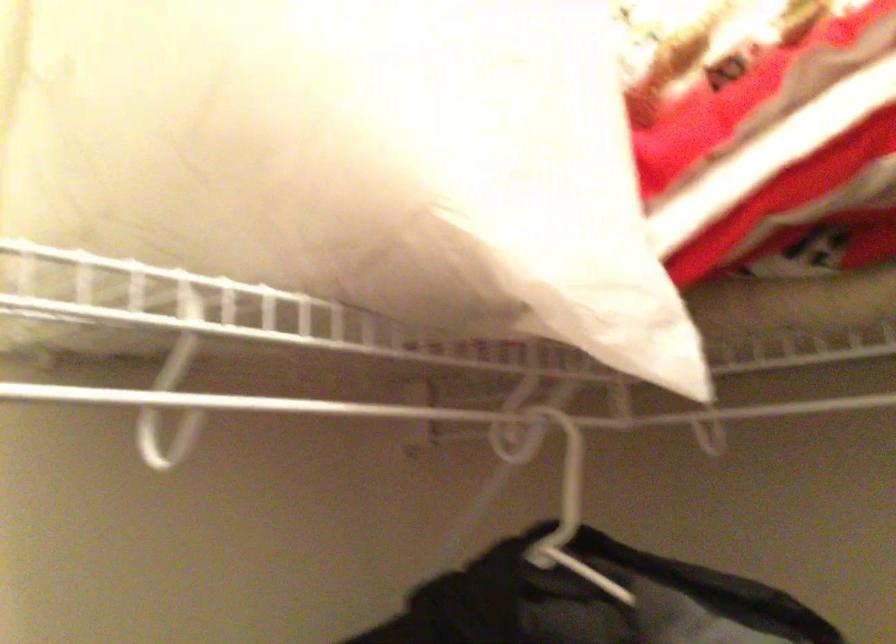
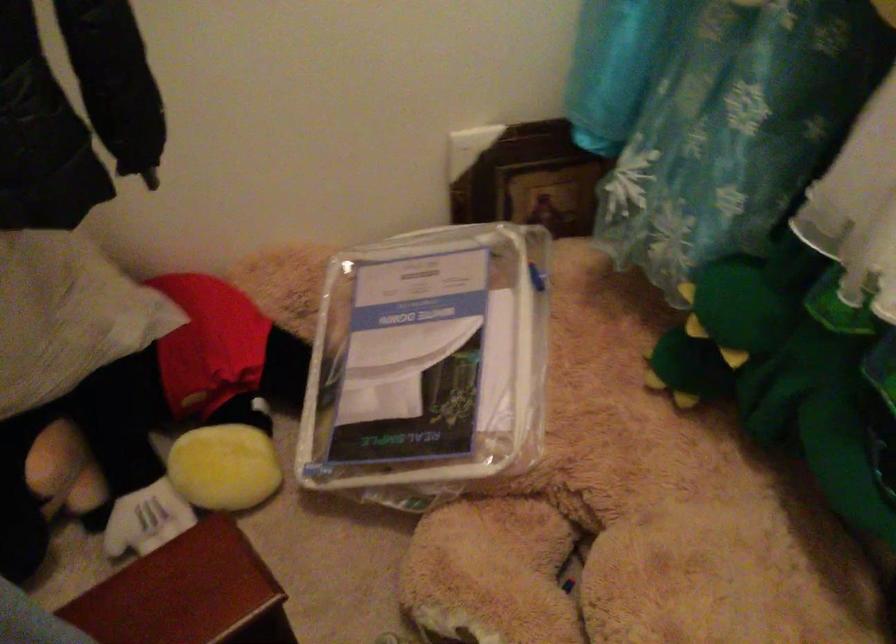
Based on the photo, the first image is from the beginning of the video and the second image is from the end. How did the camera likely rotate when shooting the video?

The rotation direction of the camera is right-down.